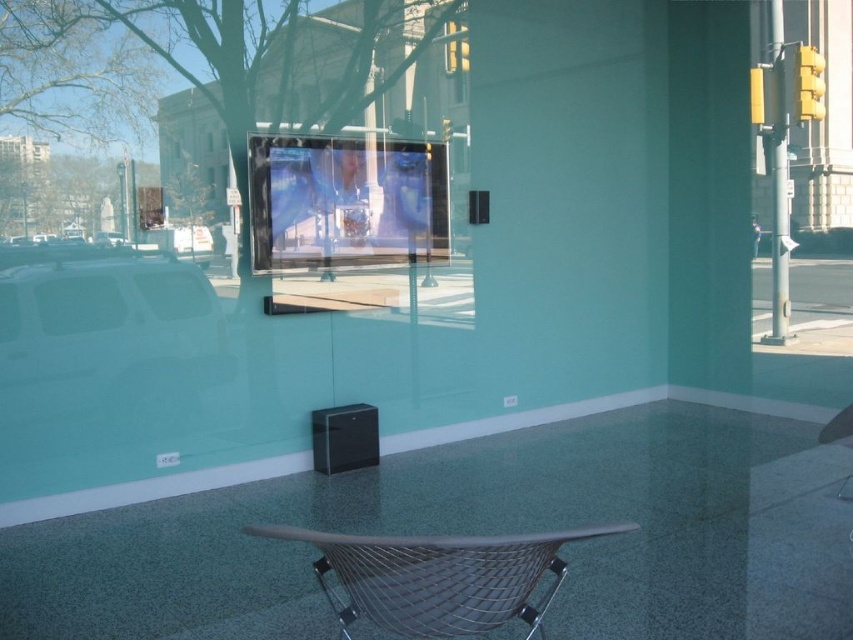
Between transparent glass window at center and metallic wire folding chair at center, which one appears on the left side from the viewer's perspective?

transparent glass window at center is more to the left.

Between transparent glass window at center and metallic wire folding chair at center, which one has more height?

With more height is transparent glass window at center.

Is point (383, 227) less distant than point (538, 605)?

No, (383, 227) is behind (538, 605).

Find the location of a particular element. transparent glass window at center is located at coordinates (347, 204).